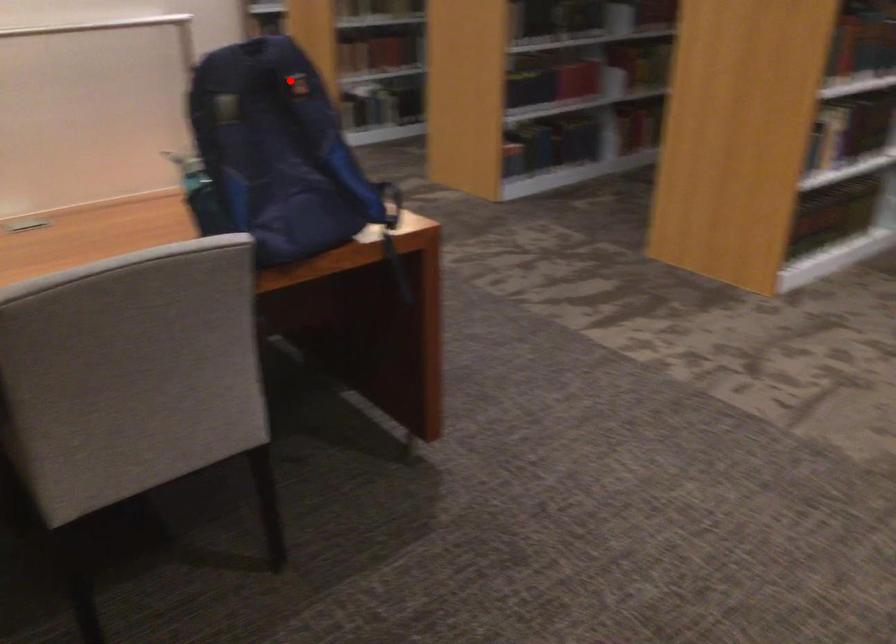
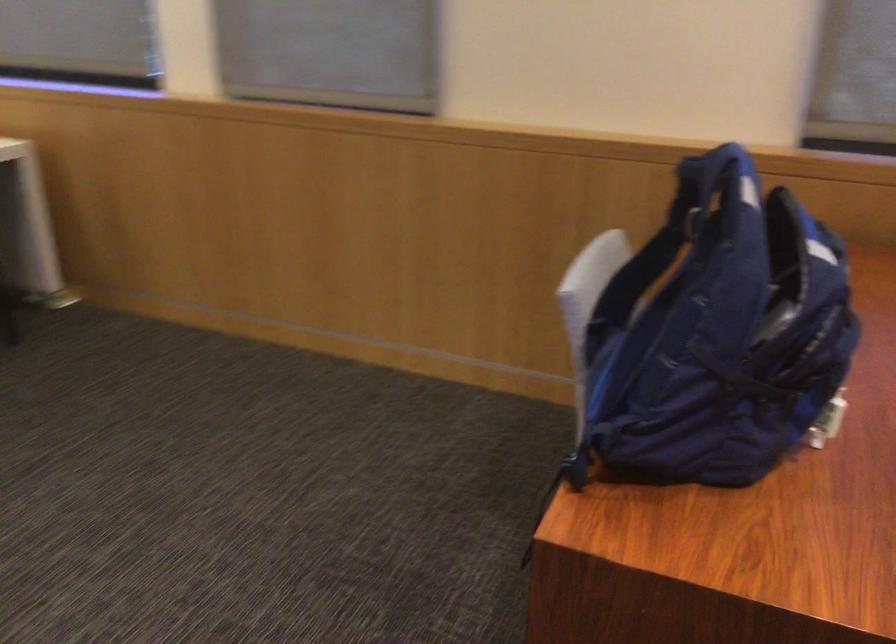
Find the pixel in the second image that matches the highlighted location in the first image.

(687, 216)